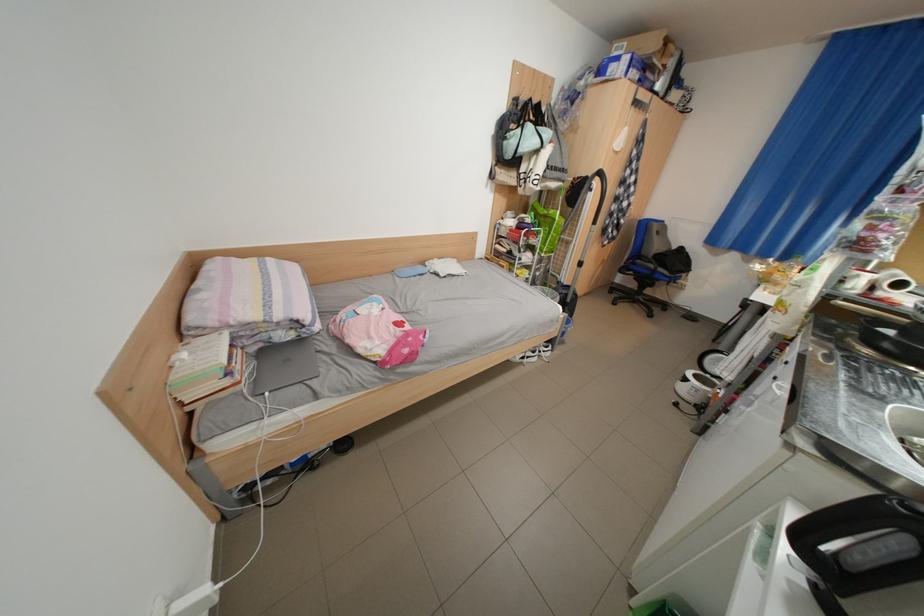
This screenshot has height=616, width=924. What are the coordinates of `gray laptop` in the screenshot? It's located at (284, 365).